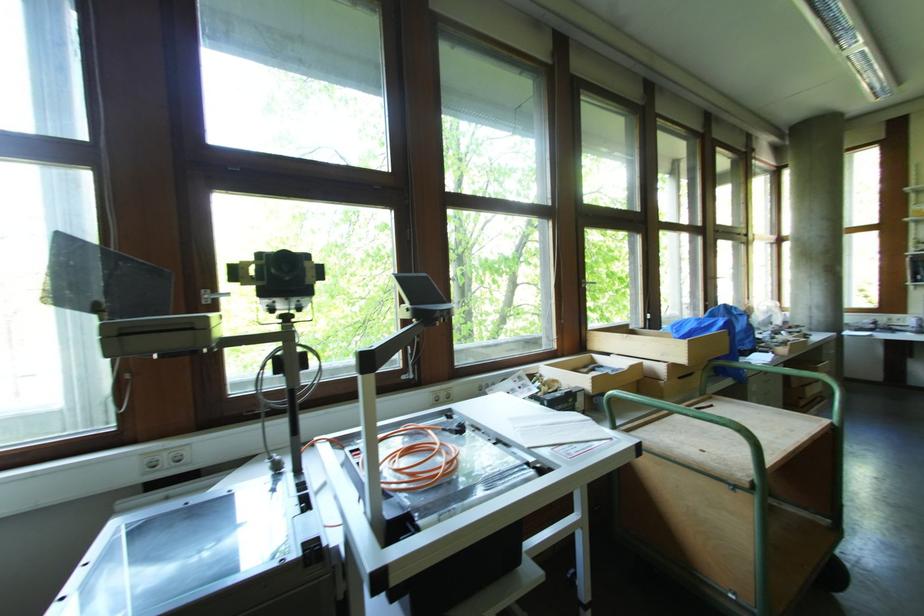
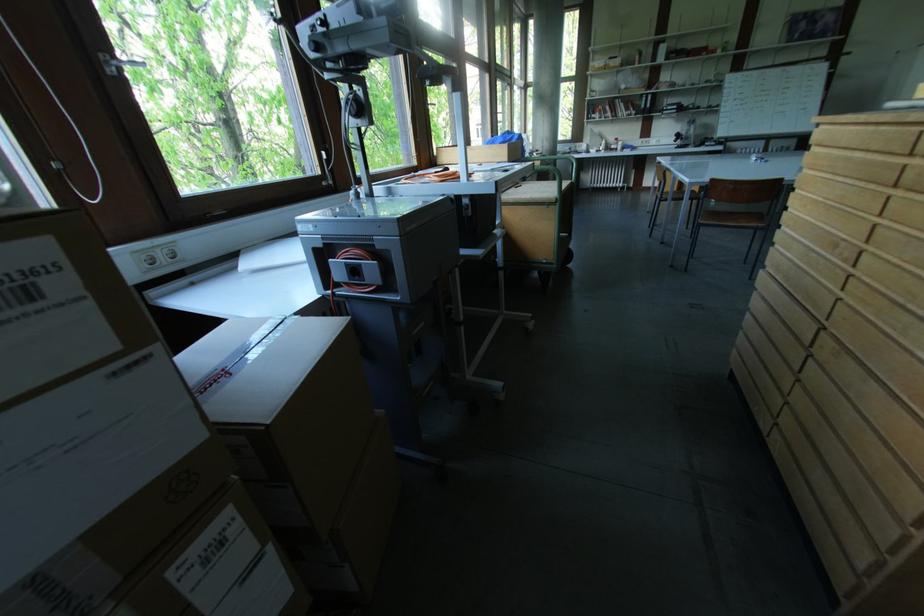
The point at (213, 302) is marked in the first image. Where is the corresponding point in the second image?

(116, 73)